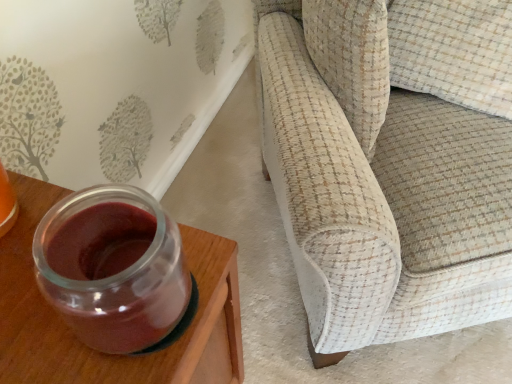
Question: Would you say transparent glass jar at left is a long distance from textured beige fabric couch at right?

Choices:
 (A) no
 (B) yes

Answer: (A)

Question: Considering the relative sizes of transparent glass jar at left and textured beige fabric couch at right in the image provided, is transparent glass jar at left shorter than textured beige fabric couch at right?

Choices:
 (A) no
 (B) yes

Answer: (B)

Question: Considering the relative sizes of transparent glass jar at left and textured beige fabric couch at right in the image provided, is transparent glass jar at left smaller than textured beige fabric couch at right?

Choices:
 (A) no
 (B) yes

Answer: (B)

Question: Does transparent glass jar at left come in front of textured beige fabric couch at right?

Choices:
 (A) yes
 (B) no

Answer: (A)

Question: Considering the relative sizes of transparent glass jar at left and textured beige fabric couch at right in the image provided, is transparent glass jar at left thinner than textured beige fabric couch at right?

Choices:
 (A) yes
 (B) no

Answer: (A)

Question: Is textured beige fabric couch at right inside transparent glass jar at left?

Choices:
 (A) no
 (B) yes

Answer: (A)

Question: Is textured beige fabric couch at right positioned far away from transparent glass jar at left?

Choices:
 (A) no
 (B) yes

Answer: (A)

Question: Can transparent glass jar at left be found inside textured beige fabric couch at right?

Choices:
 (A) no
 (B) yes

Answer: (A)

Question: Considering the relative sizes of textured beige fabric couch at right and transparent glass jar at left in the image provided, is textured beige fabric couch at right wider than transparent glass jar at left?

Choices:
 (A) yes
 (B) no

Answer: (A)

Question: Is textured beige fabric couch at right thinner than transparent glass jar at left?

Choices:
 (A) no
 (B) yes

Answer: (A)

Question: Is textured beige fabric couch at right not within transparent glass jar at left?

Choices:
 (A) no
 (B) yes

Answer: (B)

Question: Does textured beige fabric couch at right have a greater height compared to transparent glass jar at left?

Choices:
 (A) yes
 (B) no

Answer: (A)

Question: Is transparent glass jar at left to the left or to the right of textured beige fabric couch at right in the image?

Choices:
 (A) left
 (B) right

Answer: (A)